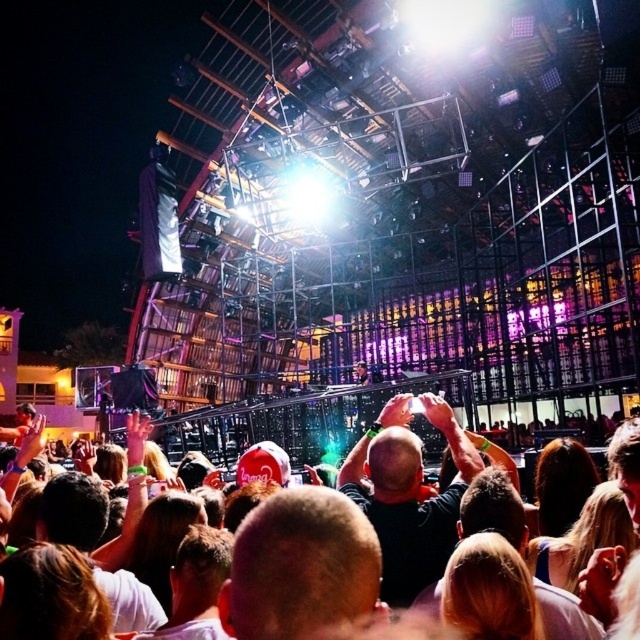
Based on the photo, which is more to the left, dark gray shirt at center or white cloth crowd at center?

white cloth crowd at center

Who is more forward, (440, 548) or (410, 444)?

Positioned in front is point (440, 548).

Find the location of a particular element. dark gray shirt at center is located at coordinates (408, 493).